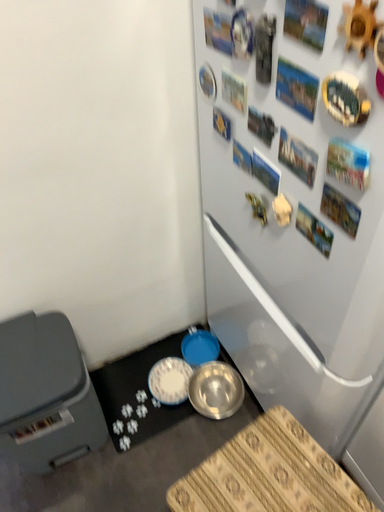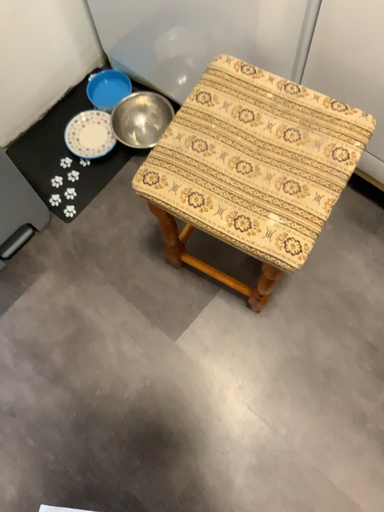
Question: Which way did the camera rotate in the video?

Choices:
 (A) rotated right
 (B) rotated left

Answer: (A)